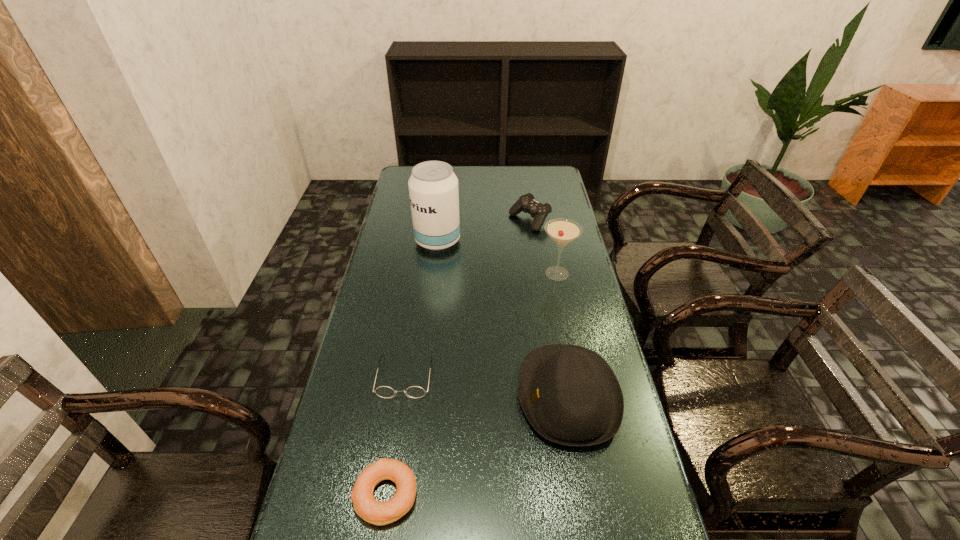
Identify the location of control that is positioned at the right edge. This screenshot has width=960, height=540. [526, 203].

Where is `free space at the left edge of the desktop`? The image size is (960, 540). free space at the left edge of the desktop is located at coordinates pos(382,254).

What are the coordinates of `vacant space at the right edge of the desktop` in the screenshot? It's located at (556, 312).

This screenshot has height=540, width=960. In the image, there is a desktop. Identify the location of vacant space at the far right corner. (556, 167).

Identify the location of vacant space in between the third tallest object and the second tallest object. (563, 335).

I want to click on free space between the spectacles and the nearest object, so click(x=396, y=436).

Find the location of a particular element. vacant region between the fifth shortest object and the bagel is located at coordinates (471, 384).

The image size is (960, 540). In order to click on free space between the bagel and the martini in this screenshot , I will do `click(471, 384)`.

Where is `unoccupied area between the control and the tallest object`? The height and width of the screenshot is (540, 960). unoccupied area between the control and the tallest object is located at coordinates (484, 231).

Where is `vacant area that lies between the tallest object and the nearest object`? vacant area that lies between the tallest object and the nearest object is located at coordinates (412, 368).